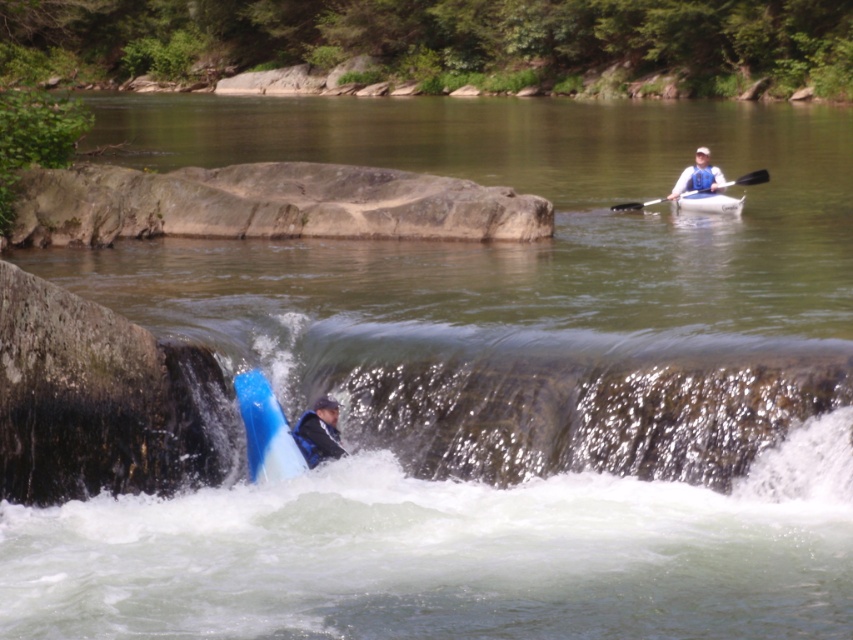
Is blue glossy kayak at lower center closer to the viewer compared to blue rubber kayak at lower left?

Yes.

Between blue glossy kayak at lower center and blue rubber kayak at lower left, which one is positioned higher?

blue glossy kayak at lower center is higher up.

Image resolution: width=853 pixels, height=640 pixels. Find the location of `blue glossy kayak at lower center`. blue glossy kayak at lower center is located at coordinates (265, 432).

Find the location of a particular element. blue glossy kayak at lower center is located at coordinates (265, 432).

Can you confirm if blue glossy kayak at lower center is positioned below white rubber canoe at upper center?

Correct, blue glossy kayak at lower center is located below white rubber canoe at upper center.

This screenshot has height=640, width=853. What are the coordinates of `blue glossy kayak at lower center` in the screenshot? It's located at (265, 432).

Identify the location of blue rubber kayak at lower left. The image size is (853, 640). (318, 432).